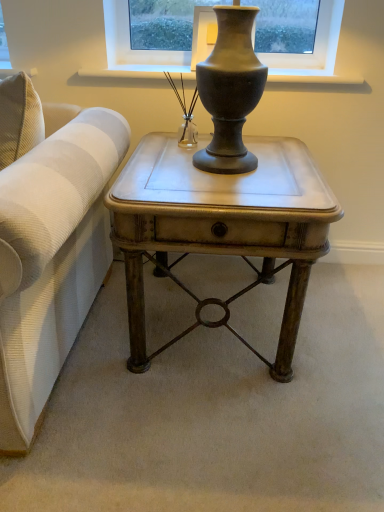
What do you see at coordinates (185, 114) in the screenshot?
I see `clear glass vase at center` at bounding box center [185, 114].

You are a GUI agent. You are given a task and a screenshot of the screen. Output one action in this format:
    pyautogui.click(x=<x>, y=<y>)
    Task: Click on the matte gray vase at upper center
    Image resolution: width=384 pixels, height=512 pixels.
    Given the screenshot: What is the action you would take?
    pyautogui.click(x=317, y=79)

Find the location of `matte metallic side table at center`. matte metallic side table at center is located at coordinates (222, 226).

The height and width of the screenshot is (512, 384). I want to click on clear glass vase at center, so click(x=185, y=114).

Locate an element on the screen. table that is under the clear glass vase at center (from a real-world perspective) is located at coordinates (222, 226).

Is matte metallic side table at center positioned far away from clear glass vase at center?

No, matte metallic side table at center is not far from clear glass vase at center.

From a real-world perspective, which object rests below the other?

From a 3D spatial view, matte metallic side table at center is below.

Considering the sizes of objects matte metallic side table at center and clear glass vase at center in the image provided, who is smaller, matte metallic side table at center or clear glass vase at center?

clear glass vase at center.

Can you confirm if clear glass vase at center is wider than matte gray vase at upper center?

No, clear glass vase at center is not wider than matte gray vase at upper center.

Is clear glass vase at center further to the viewer compared to matte gray vase at upper center?

No, it is in front of matte gray vase at upper center.

Is clear glass vase at center completely or partially outside of matte gray vase at upper center?

Yes.

Which point is more distant from viewer, (181, 143) or (346, 79)?

The point (346, 79) is farther from the camera.

Locate an element on the screen. Image resolution: width=384 pixels, height=512 pixels. table lying below the clear glass vase at center (from the image's perspective) is located at coordinates (222, 226).

Which is behind, point (187, 128) or point (291, 170)?

Point (187, 128)

Is clear glass vase at center aimed at matte metallic side table at center?

No, clear glass vase at center is not turned towards matte metallic side table at center.

Between clear glass vase at center and matte metallic side table at center, which one has more height?

matte metallic side table at center.

Based on the photo, considering the sizes of matte gray vase at upper center and clear glass vase at center in the image, is matte gray vase at upper center wider or thinner than clear glass vase at center?

Clearly, matte gray vase at upper center has more width compared to clear glass vase at center.

Between matte gray vase at upper center and clear glass vase at center, which one appears on the left side from the viewer's perspective?

clear glass vase at center.

Between matte gray vase at upper center and clear glass vase at center, which one has more height?

clear glass vase at center.

Are matte gray vase at upper center and clear glass vase at center making contact?

No, matte gray vase at upper center is not with clear glass vase at center.

Measure the distance between matte metallic side table at center and matte gray vase at upper center.

matte metallic side table at center is 29.86 inches away from matte gray vase at upper center.

In the image, there is a matte gray vase at upper center. Find the location of `table below it (from the image's perspective)`. table below it (from the image's perspective) is located at coordinates (222, 226).

Would you consider matte metallic side table at center to be distant from matte gray vase at upper center?

No, matte metallic side table at center is not far from matte gray vase at upper center.

Is matte gray vase at upper center located outside matte metallic side table at center?

Yes, matte gray vase at upper center is located beyond the bounds of matte metallic side table at center.

How different are the orientations of matte gray vase at upper center and matte metallic side table at center in degrees?

1.17 degrees separate the facing orientations of matte gray vase at upper center and matte metallic side table at center.

Is matte gray vase at upper center looking in the opposite direction of matte metallic side table at center?

matte gray vase at upper center does not have its back to matte metallic side table at center.

From a real-world perspective, does matte gray vase at upper center stand above matte metallic side table at center?

Yes, from a real-world perspective, matte gray vase at upper center is on top of matte metallic side table at center.

Locate an element on the screen. The image size is (384, 512). table in front of the clear glass vase at center is located at coordinates (222, 226).

I want to click on window sill behind the clear glass vase at center, so click(317, 79).

Estimate the real-world distances between objects in this image. Which object is further from clear glass vase at center, matte metallic side table at center or matte gray vase at upper center?

The object further to clear glass vase at center is matte metallic side table at center.

From the image, which object appears to be farther from matte gray vase at upper center, clear glass vase at center or matte metallic side table at center?

Based on the image, matte metallic side table at center appears to be further to matte gray vase at upper center.

From the image, which object appears to be nearer to clear glass vase at center, matte gray vase at upper center or matte metallic side table at center?

Based on the image, matte gray vase at upper center appears to be nearer to clear glass vase at center.

Based on their spatial positions, is clear glass vase at center or matte gray vase at upper center closer to matte metallic side table at center?

Among the two, clear glass vase at center is located nearer to matte metallic side table at center.

Considering their positions, is matte metallic side table at center positioned further to matte gray vase at upper center than clear glass vase at center?

matte metallic side table at center is positioned further to the anchor matte gray vase at upper center.

Which object lies nearer to the anchor point matte metallic side table at center, matte gray vase at upper center or clear glass vase at center?

Among the two, clear glass vase at center is located nearer to matte metallic side table at center.

Find the location of a particular element. Image resolution: width=384 pixels, height=512 pixels. candle holder that lies between matte gray vase at upper center and matte metallic side table at center from top to bottom is located at coordinates (185, 114).